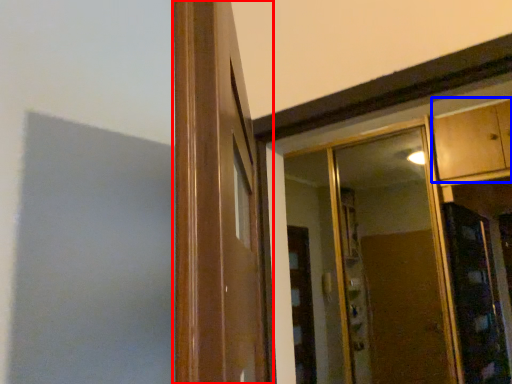
Question: Among these objects, which one is farthest to the camera, window frame (highlighted by a red box) or cabinetry (highlighted by a blue box)?

Choices:
 (A) window frame
 (B) cabinetry

Answer: (B)